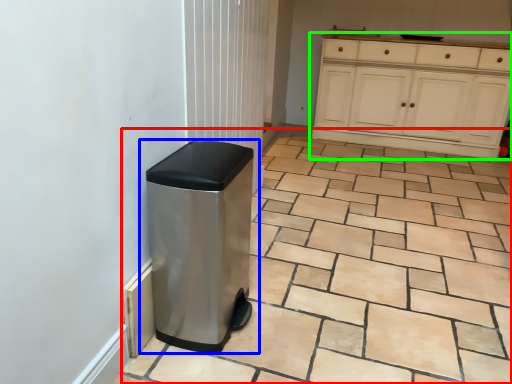
Question: Based on their relative distances, which object is farther from ceramic tile (highlighted by a red box)? Choose from waste container (highlighted by a blue box) and cabinetry (highlighted by a green box).

Choices:
 (A) waste container
 (B) cabinetry

Answer: (B)